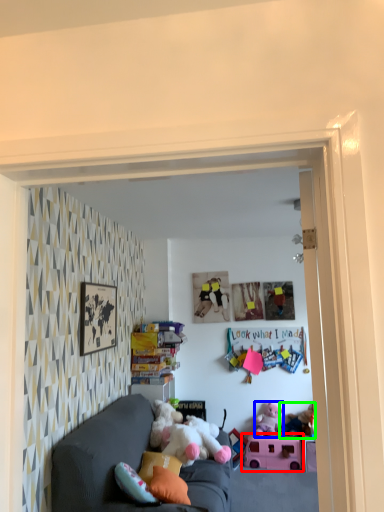
Question: Based on their relative distances, which object is nearer to toy (highlighted by a red box)? Choose from toy (highlighted by a blue box) and toy (highlighted by a green box).

Choices:
 (A) toy
 (B) toy

Answer: (A)